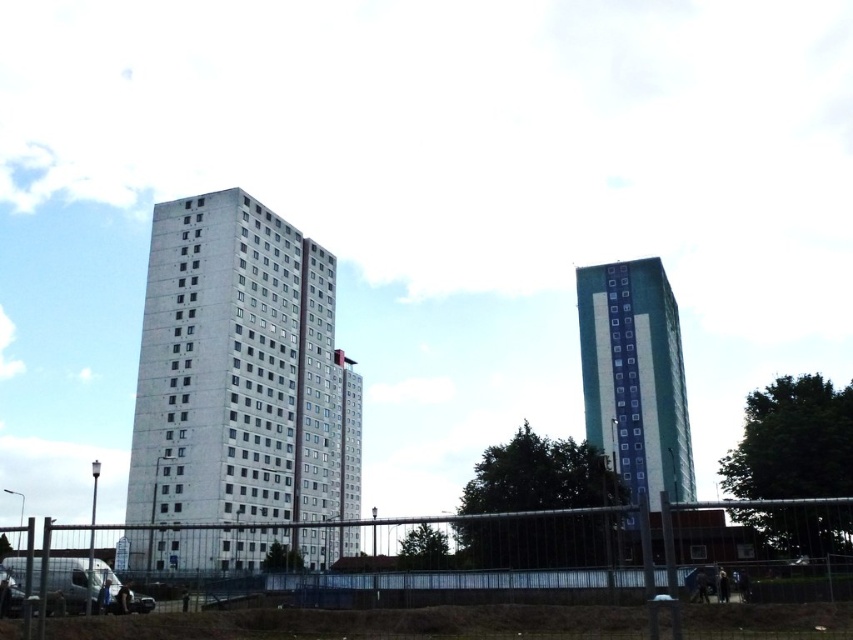
You are a city planner assessing the view from a new park bench. The bench is placed such that you can see both the metal fence at lower center and the teal glass tower at right. Which object appears wider in your field of view?

The metal fence at lower center appears wider in the field of view because its width is larger than that of the teal glass tower at right.

In the scene shown: You are standing in front of a metal fence and want to take a photo of both the concrete building at center and the teal glass tower at right. The camera you have can only focus on objects within 100 feet. Will both buildings be in focus?

The concrete building at center is 116.29 feet away from the teal glass tower at right. Since the distance between them is greater than 100 feet, the camera cannot focus on both buildings simultaneously.